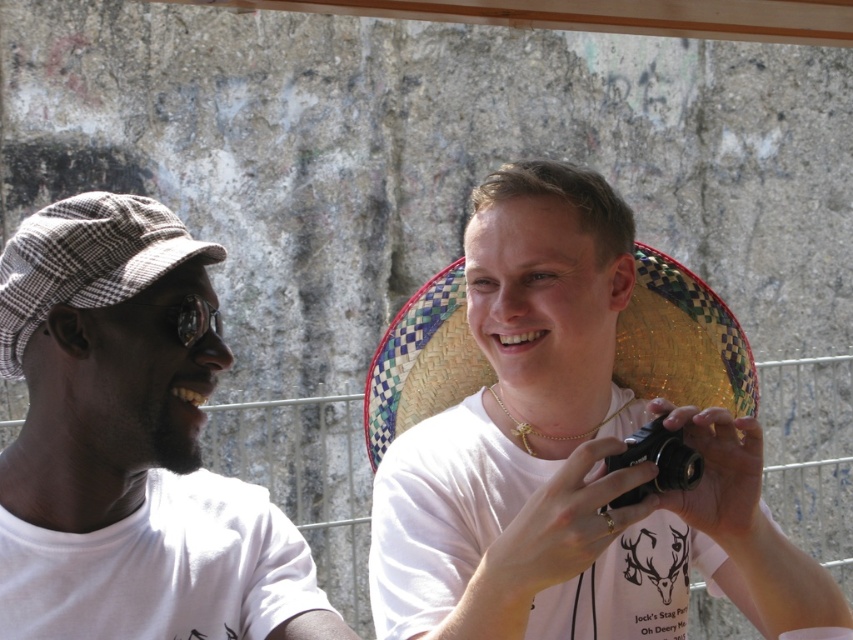
Is point (416, 410) positioned in front of point (50, 291)?

No, (416, 410) is behind (50, 291).

Which of these two, woven straw sombrero at center or checkered fabric baseball cap at left, stands shorter?

woven straw sombrero at center

Which is behind, point (461, 316) or point (88, 195)?

Positioned behind is point (461, 316).

Locate an element on the screen. woven straw sombrero at center is located at coordinates (682, 340).

Does woven straw sombrero at center appear on the right side of black plastic camera at center?

No, woven straw sombrero at center is not to the right of black plastic camera at center.

Is woven straw sombrero at center behind black plastic camera at center?

Yes.

Is point (699, 333) in front of point (701, 468)?

No.

I want to click on woven straw sombrero at center, so click(682, 340).

Does point (544, 164) come farther from viewer compared to point (70, 296)?

Yes, it is behind point (70, 296).

Can you confirm if white matte camera at center is positioned above checkered fabric baseball cap at left?

No, white matte camera at center is not above checkered fabric baseball cap at left.

Which is behind, point (592, 492) or point (68, 230)?

The point (592, 492) is behind.

Image resolution: width=853 pixels, height=640 pixels. I want to click on white matte camera at center, so click(567, 458).